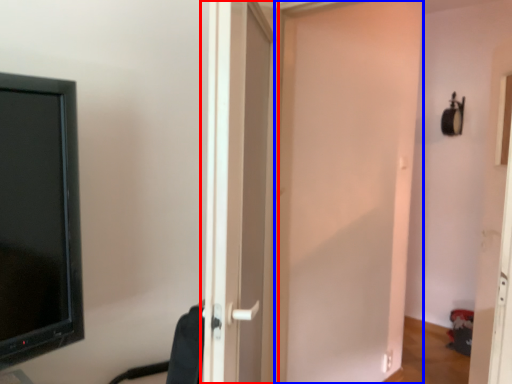
Question: Which object is closer to the camera taking this photo, door (highlighted by a red box) or door (highlighted by a blue box)?

Choices:
 (A) door
 (B) door

Answer: (A)